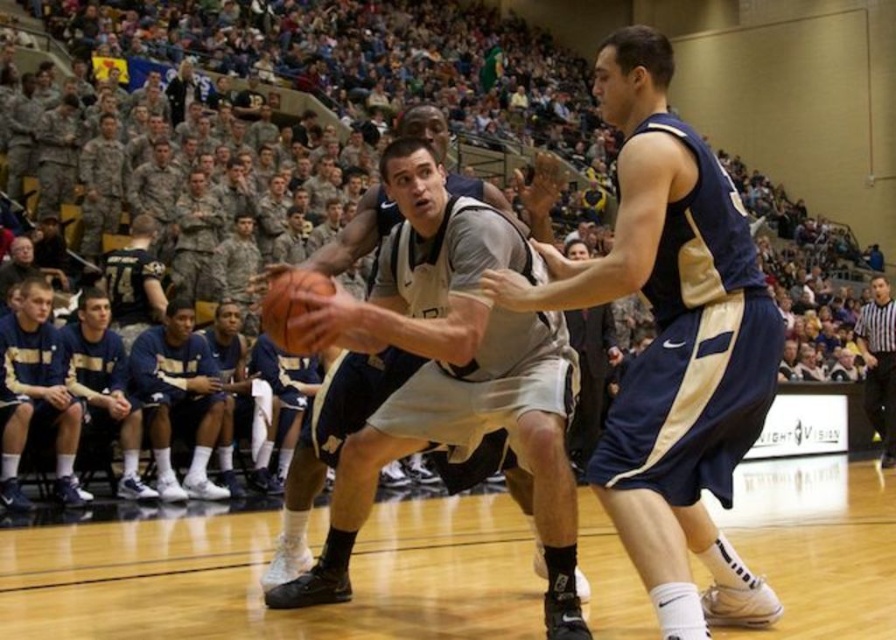
You are a referee watching the game from the sidelines. You notice the matte gray jersey at center and the dark blue jersey at lower left. Which player is positioned lower on the court?

The matte gray jersey at center is located below the dark blue jersey at lower left, meaning the player in the matte gray jersey at center is positioned lower on the court.